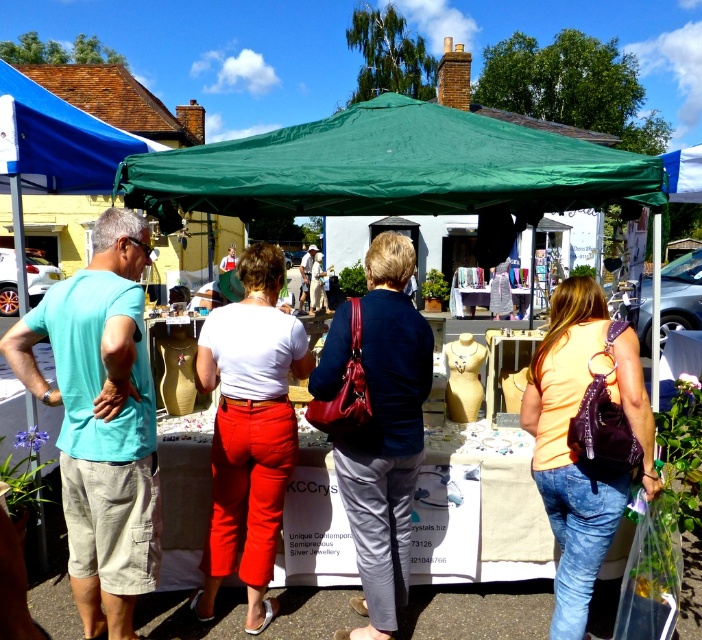
Does green fabric canopy at center have a larger size compared to matte white blouse at center?

Indeed, green fabric canopy at center has a larger size compared to matte white blouse at center.

Can you confirm if green fabric canopy at center is positioned to the left of matte white blouse at center?

Incorrect, green fabric canopy at center is not on the left side of matte white blouse at center.

This screenshot has width=702, height=640. I want to click on green fabric canopy at center, so click(x=390, y=170).

Consider the image. Is orange matte backpack at right closer to camera compared to blue fabric canopy at upper left?

Yes, it is.

Measure the distance between point (555, 636) and camera.

They are 10.09 feet apart.

Identify the location of orange matte backpack at right. This screenshot has height=640, width=702. (574, 452).

Does teal fabric shirt at left have a greater width compared to blue fabric canopy at upper left?

No, teal fabric shirt at left is not wider than blue fabric canopy at upper left.

Is teal fabric shirt at left further to the viewer compared to blue fabric canopy at upper left?

That is False.

Which is in front, point (100, 532) or point (100, 120)?

Positioned in front is point (100, 532).

Identify the location of teal fabric shirt at left. The image size is (702, 640). (100, 420).